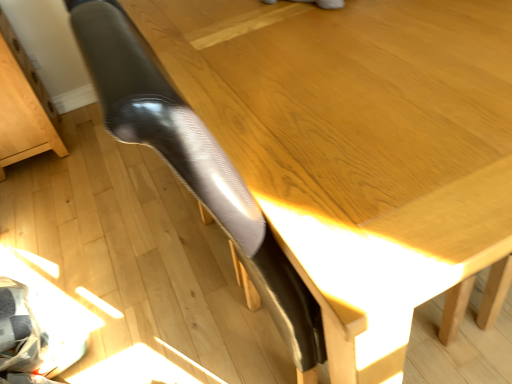
The image size is (512, 384). What are the coordinates of `light brown wood drawer at lower left` in the screenshot? It's located at (23, 105).

The image size is (512, 384). What do you see at coordinates (23, 105) in the screenshot?
I see `light brown wood drawer at lower left` at bounding box center [23, 105].

What do you see at coordinates (160, 117) in the screenshot? This screenshot has width=512, height=384. I see `glossy black chair leg at center` at bounding box center [160, 117].

I want to click on glossy black chair leg at center, so click(x=160, y=117).

In order to click on light brown wood drawer at lower left in this screenshot , I will do `click(23, 105)`.

Which object is positioned more to the left, light brown wood drawer at lower left or glossy black chair leg at center?

light brown wood drawer at lower left.

Considering the relative positions of light brown wood drawer at lower left and glossy black chair leg at center in the image provided, is light brown wood drawer at lower left in front of glossy black chair leg at center?

No, light brown wood drawer at lower left is further to the viewer.

Which is nearer, (57, 126) or (104, 33)?

The point (104, 33) is more forward.

From the image's perspective, is light brown wood drawer at lower left above or below glossy black chair leg at center?

Based on their image positions, light brown wood drawer at lower left is located above glossy black chair leg at center.

From a real-world perspective, relative to glossy black chair leg at center, is light brown wood drawer at lower left vertically above or below?

light brown wood drawer at lower left is below glossy black chair leg at center.

Between light brown wood drawer at lower left and glossy black chair leg at center, which one has larger width?

Wider between the two is light brown wood drawer at lower left.

Which of these two, light brown wood drawer at lower left or glossy black chair leg at center, stands shorter?

Standing shorter between the two is light brown wood drawer at lower left.

Considering the relative sizes of light brown wood drawer at lower left and glossy black chair leg at center in the image provided, is light brown wood drawer at lower left smaller than glossy black chair leg at center?

Yes, light brown wood drawer at lower left is smaller than glossy black chair leg at center.

Is light brown wood drawer at lower left not within glossy black chair leg at center?

Yes, light brown wood drawer at lower left is not within glossy black chair leg at center.

Is light brown wood drawer at lower left not near glossy black chair leg at center?

light brown wood drawer at lower left is far away from glossy black chair leg at center.

Could you tell me if light brown wood drawer at lower left is facing glossy black chair leg at center?

No.

This screenshot has width=512, height=384. In order to click on furniture located underneath the glossy black chair leg at center (from a real-world perspective) in this screenshot , I will do `click(23, 105)`.

Which object is positioned more to the left, glossy black chair leg at center or light brown wood drawer at lower left?

light brown wood drawer at lower left is more to the left.

Which object is closer to the camera, glossy black chair leg at center or light brown wood drawer at lower left?

glossy black chair leg at center.

Which is closer, (x=98, y=54) or (x=1, y=159)?

Point (x=98, y=54) appears to be closer to the viewer than point (x=1, y=159).

Based on the photo, from the image's perspective, is glossy black chair leg at center below light brown wood drawer at lower left?

Indeed, from the image's perspective, glossy black chair leg at center is shown beneath light brown wood drawer at lower left.

From a real-world perspective, does glossy black chair leg at center stand above light brown wood drawer at lower left?

Yes, from a real-world perspective, glossy black chair leg at center is above light brown wood drawer at lower left.

Which of these two, glossy black chair leg at center or light brown wood drawer at lower left, is thinner?

Thinner between the two is glossy black chair leg at center.

Is glossy black chair leg at center taller than light brown wood drawer at lower left?

Yes.

Is glossy black chair leg at center bigger or smaller than light brown wood drawer at lower left?

Clearly, glossy black chair leg at center is larger in size than light brown wood drawer at lower left.

Is glossy black chair leg at center surrounding light brown wood drawer at lower left?

Definitely not — light brown wood drawer at lower left is not inside glossy black chair leg at center.

Is glossy black chair leg at center not near light brown wood drawer at lower left?

Indeed, glossy black chair leg at center is not near light brown wood drawer at lower left.

Is glossy black chair leg at center facing towards light brown wood drawer at lower left?

No, glossy black chair leg at center is not oriented towards light brown wood drawer at lower left.

In the scene shown: How far apart are glossy black chair leg at center and light brown wood drawer at lower left?

4.45 feet.

The width and height of the screenshot is (512, 384). In order to click on leg in front of the light brown wood drawer at lower left in this screenshot , I will do click(x=160, y=117).

What are the coordinates of `leg on the right of light brown wood drawer at lower left` in the screenshot? It's located at (160, 117).

I want to click on furniture below the glossy black chair leg at center (from a real-world perspective), so click(23, 105).